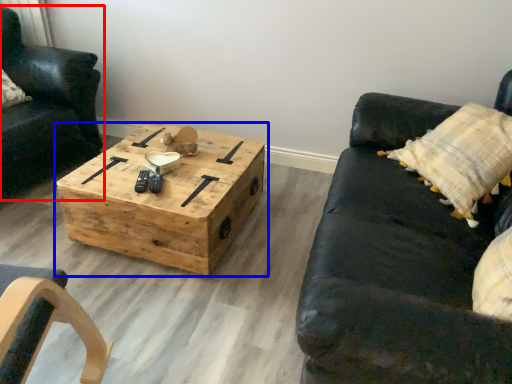
Question: Which of the following is the farthest to the observer, chair (highlighted by a red box) or coffee table (highlighted by a blue box)?

Choices:
 (A) chair
 (B) coffee table

Answer: (A)